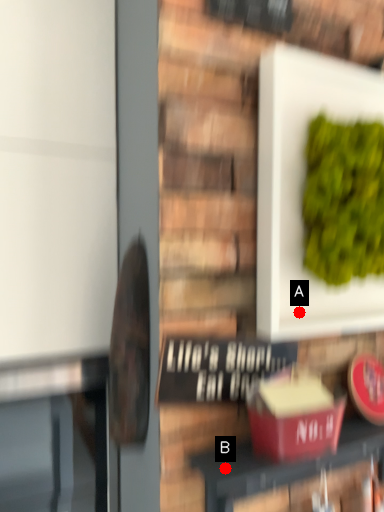
Question: Two points are circled on the image, labeled by A and B beside each circle. Which point is closer to the camera?

Choices:
 (A) A is closer
 (B) B is closer

Answer: (B)